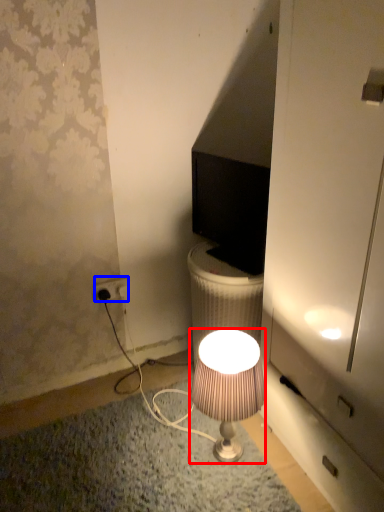
Question: Among these objects, which one is nearest to the camera, lamp (highlighted by a red box) or power outlet (highlighted by a blue box)?

Choices:
 (A) lamp
 (B) power outlet

Answer: (A)